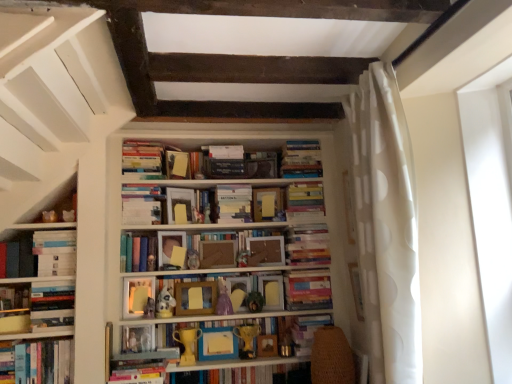
What is the approximate width of plush gray cat at center, the 7th toy when ordered from right to left?

It is 3.97 inches.

The height and width of the screenshot is (384, 512). What do you see at coordinates (52, 86) in the screenshot? I see `white painted wood at upper left` at bounding box center [52, 86].

This screenshot has height=384, width=512. What do you see at coordinates (272, 292) in the screenshot?
I see `matte yellow paper at center, which is the fifth paperback book in bottom-to-top order` at bounding box center [272, 292].

Image resolution: width=512 pixels, height=384 pixels. What are the coordinates of `matte paper book at center, placed as the eleventh paperback book when sorted from bottom to top` in the screenshot? It's located at (233, 203).

The width and height of the screenshot is (512, 384). I want to click on plush gray cat at center, which appears as the 1th toy when viewed from the left, so click(x=149, y=308).

Considering the relative positions of matte paper book at center, the 5th paperback book when ordered from top to bottom, and hardcover book at center, marked as the second paperback book in a top-to-bottom arrangement, in the image provided, is matte paper book at center, the 5th paperback book when ordered from top to bottom, in front of hardcover book at center, marked as the second paperback book in a top-to-bottom arrangement,?

Result: Yes, the depth of matte paper book at center, the 5th paperback book when ordered from top to bottom, is less than that of hardcover book at center, marked as the second paperback book in a top-to-bottom arrangement.

Is hardcover book at center, which is the fourteenth paperback book from bottom to top, at the back of matte paper book at center, the 5th paperback book when ordered from top to bottom?

No, matte paper book at center, the 5th paperback book when ordered from top to bottom,'s orientation is not away from hardcover book at center, which is the fourteenth paperback book from bottom to top.

Is matte paper book at center, the 5th paperback book when ordered from top to bottom, at the right side of hardcover book at center, which is the fourteenth paperback book from bottom to top?

In fact, matte paper book at center, the 5th paperback book when ordered from top to bottom, is to the left of hardcover book at center, which is the fourteenth paperback book from bottom to top.

From the image's perspective, between matte paper book at center, the 5th paperback book when ordered from top to bottom, and hardcover book at center, which is the fourteenth paperback book from bottom to top, which one is located above?

hardcover book at center, which is the fourteenth paperback book from bottom to top, is shown above in the image.

Is matte yellow paper at center, which is the 15th paperback book from bottom to top, taller or shorter than matte paper book at center, the 5th paperback book when ordered from top to bottom?

Considering their sizes, matte yellow paper at center, which is the 15th paperback book from bottom to top, has less height than matte paper book at center, the 5th paperback book when ordered from top to bottom.

Could you tell me if matte yellow paper at center, which is the first paperback book in top-to-bottom order, is turned towards matte paper book at center, placed as the eleventh paperback book when sorted from bottom to top?

No, matte yellow paper at center, which is the first paperback book in top-to-bottom order, is not turned towards matte paper book at center, placed as the eleventh paperback book when sorted from bottom to top.

Can you confirm if matte yellow paper at center, which is the first paperback book in top-to-bottom order, is thinner than matte paper book at center, placed as the eleventh paperback book when sorted from bottom to top?

Indeed, matte yellow paper at center, which is the first paperback book in top-to-bottom order, has a lesser width compared to matte paper book at center, placed as the eleventh paperback book when sorted from bottom to top.

Which of these two, matte yellow paper at center, which is the 15th paperback book from bottom to top, or matte paper book at center, placed as the eleventh paperback book when sorted from bottom to top, is smaller?

With smaller size is matte yellow paper at center, which is the 15th paperback book from bottom to top.

From a real-world perspective, between matte yellow paper at center, which is the first paperback book in top-to-bottom order, and hardcover book at center, placed as the tenth book when sorted from top to bottom, who is vertically higher?

From a 3D spatial view, matte yellow paper at center, which is the first paperback book in top-to-bottom order, is above.

Consider the image. Considering their positions, is matte yellow paper at center, which is the first paperback book in top-to-bottom order, located in front of or behind hardcover book at center, placed as the tenth book when sorted from top to bottom?

Visually, matte yellow paper at center, which is the first paperback book in top-to-bottom order, is located behind hardcover book at center, placed as the tenth book when sorted from top to bottom.

Image resolution: width=512 pixels, height=384 pixels. What are the coordinates of `the 9th paperback book behind the hardcover book at center, placed as the tenth book when sorted from top to bottom` in the screenshot? It's located at (177, 165).

Is point (40, 342) farther from camera compared to point (258, 247)?

No, it is not.

Is hardcover book at lower left, the third book from the bottom, facing towards wooden frame at center, the seventh paperback book ordered from the bottom?

No, hardcover book at lower left, the third book from the bottom, does not turn towards wooden frame at center, the seventh paperback book ordered from the bottom.

Is hardcover book at lower left, the third book from the bottom, positioned beyond the bounds of wooden frame at center, which is the ninth paperback book in top-to-bottom order?

Yes.

Visually, is hardcover book at lower left, the 8th book positioned from the top, positioned to the left or to the right of wooden frame at center, which is the ninth paperback book in top-to-bottom order?

In the image, hardcover book at lower left, the 8th book positioned from the top, appears on the left side of wooden frame at center, which is the ninth paperback book in top-to-bottom order.

Does plush gray cat at center, which appears as the 1th toy when viewed from the left, appear on the left side of white matte bookshelf at center?

Indeed, plush gray cat at center, which appears as the 1th toy when viewed from the left, is positioned on the left side of white matte bookshelf at center.

Which is correct: plush gray cat at center, which appears as the 1th toy when viewed from the left, is inside white matte bookshelf at center, or outside of it?

plush gray cat at center, which appears as the 1th toy when viewed from the left, is spatially positioned inside white matte bookshelf at center.

From a real-world perspective, is gold metallic trophy at center, which appears as the 5th toy when viewed from the right, on top of wooden frame at center, which is counted as the seventh book, starting from the top?

Actually, gold metallic trophy at center, which appears as the 5th toy when viewed from the right, is physically below wooden frame at center, which is counted as the seventh book, starting from the top, in the real world.

From the image's perspective, is gold metallic trophy at center, which appears as the third toy when viewed from the left, above wooden frame at center, the 4th book in the bottom-to-top sequence?

Incorrect, from the image's perspective, gold metallic trophy at center, which appears as the third toy when viewed from the left, is lower than wooden frame at center, the 4th book in the bottom-to-top sequence.

Is gold metallic trophy at center, which appears as the 5th toy when viewed from the right, beside wooden frame at center, the 4th book in the bottom-to-top sequence?

No, gold metallic trophy at center, which appears as the 5th toy when viewed from the right, is not beside wooden frame at center, the 4th book in the bottom-to-top sequence.

Looking at this image, is gold metallic trophy at center, which appears as the third toy when viewed from the left, oriented towards wooden frame at center, the 4th book in the bottom-to-top sequence?

No, gold metallic trophy at center, which appears as the third toy when viewed from the left, is not facing towards wooden frame at center, the 4th book in the bottom-to-top sequence.

What's the angular difference between matte yellow toy at center, arranged as the fourth toy when viewed from the right, and wooden frame at center, which ranks as the tenth paperback book in top-to-bottom order,'s facing directions?

The angle between the facing direction of matte yellow toy at center, arranged as the fourth toy when viewed from the right, and the facing direction of wooden frame at center, which ranks as the tenth paperback book in top-to-bottom order, is 0.944 degrees.

Are matte yellow toy at center, arranged as the fourth toy when viewed from the right, and wooden frame at center, placed as the 6th paperback book when sorted from bottom to top, making contact?

matte yellow toy at center, arranged as the fourth toy when viewed from the right, and wooden frame at center, placed as the 6th paperback book when sorted from bottom to top, are clearly separated.

Is matte yellow toy at center, arranged as the fourth toy when viewed from the right, at the right side of wooden frame at center, which ranks as the tenth paperback book in top-to-bottom order?

No, matte yellow toy at center, arranged as the fourth toy when viewed from the right, is not to the right of wooden frame at center, which ranks as the tenth paperback book in top-to-bottom order.

At what (x,y) coordinates should I click in order to perform the action: click on the 6th paperback book behind when counting from the matte paper book at center, the 5th paperback book when ordered from top to bottom. Please return your answer as a coordinate pair (x, y). The width and height of the screenshot is (512, 384). Looking at the image, I should click on (261, 165).

Starting from the matte paper book at center, the 5th paperback book when ordered from top to bottom, which paperback book is the 5th one to the left? Please provide its 2D coordinates.

[(177, 165)]

From the image, which object appears to be nearer to white matte plush toy at center, arranged as the second toy when viewed from the left, hardcover book at center, acting as the 13th paperback book starting from the bottom, or matte yellow toy at center, arranged as the fourth toy when viewed from the right?

matte yellow toy at center, arranged as the fourth toy when viewed from the right, is closer to white matte plush toy at center, arranged as the second toy when viewed from the left.

Looking at the image, which one is located further to hardcover book at center, the 4th book from the top, hardcover books at center, the 9th book when ordered from bottom to top, or gold metallic trophy at center, which is the 2th toy in right-to-left order?

hardcover books at center, the 9th book when ordered from bottom to top, is further to hardcover book at center, the 4th book from the top.

Estimate the real-world distances between objects in this image. Which object is closer to wooden frame at center, placed as the 6th paperback book when sorted from bottom to top, hardcover book at center, which is the 3th paperback book in top-to-bottom order, or white dotted fabric at right?

hardcover book at center, which is the 3th paperback book in top-to-bottom order.

Which object lies further to the anchor point hardcover books at center, the 10th book ordered from the bottom, white matte bookshelf at center or wooden frame at center, placed as the 6th paperback book when sorted from bottom to top?

white matte bookshelf at center is positioned further to the anchor hardcover books at center, the 10th book ordered from the bottom.

Estimate the real-world distances between objects in this image. Which object is closer to hardcover book at center, placed as the 6th book when sorted from top to bottom, hardcover book at center, acting as the 13th paperback book starting from the bottom, or plush gray cat at center, the 7th toy when ordered from right to left?

hardcover book at center, acting as the 13th paperback book starting from the bottom, is positioned closer to the anchor hardcover book at center, placed as the 6th book when sorted from top to bottom.

From the picture: Considering their positions, is white painted wood at upper left positioned closer to matte yellow paperback book at center, positioned as the fourth paperback book in bottom-to-top order, than hardcover book at center, the twelfth paperback book when ordered from bottom to top?

hardcover book at center, the twelfth paperback book when ordered from bottom to top, is closer to matte yellow paperback book at center, positioned as the fourth paperback book in bottom-to-top order.

Which object lies nearer to the anchor point white matte bookshelf at center, wooden frame at center, which is counted as the seventh book, starting from the top, or matte yellow paper at center, which is the fifth paperback book in bottom-to-top order?

Among the two, wooden frame at center, which is counted as the seventh book, starting from the top, is located nearer to white matte bookshelf at center.

Looking at the image, which one is located closer to matte yellow paper at center, which is counted as the eighth paperback book, starting from the top, wooden frame at center, placed as the 6th paperback book when sorted from bottom to top, or matte plastic toy at center, the 5th toy in the left-to-right sequence?

wooden frame at center, placed as the 6th paperback book when sorted from bottom to top, lies closer to matte yellow paper at center, which is counted as the eighth paperback book, starting from the top, than the other object.

In order to click on shelf between hardcover book at lower left, the third book from the bottom, and hardcover book at center, which is the 3th paperback book in top-to-bottom order, in the horizontal direction in this screenshot , I will do `click(202, 320)`.

The height and width of the screenshot is (384, 512). What are the coordinates of `stairwell located between hardcover books at left, placed as the 3th book when sorted from top to bottom, and matte yellow paper at center, which is the 11th paperback book in top-to-bottom order, in the left-right direction` in the screenshot? It's located at (52, 86).

Identify the location of stairwell located between hardcover books at left, placed as the 3th book when sorted from top to bottom, and hardcover book at center, which is the 3th paperback book in top-to-bottom order, in the left-right direction. The height and width of the screenshot is (384, 512). (52, 86).

Locate an element on the screen. This screenshot has height=384, width=512. shelf located between hardcover books at center, acting as the 2th book starting from the top, and white dotted fabric at right in the left-right direction is located at coordinates (202, 320).